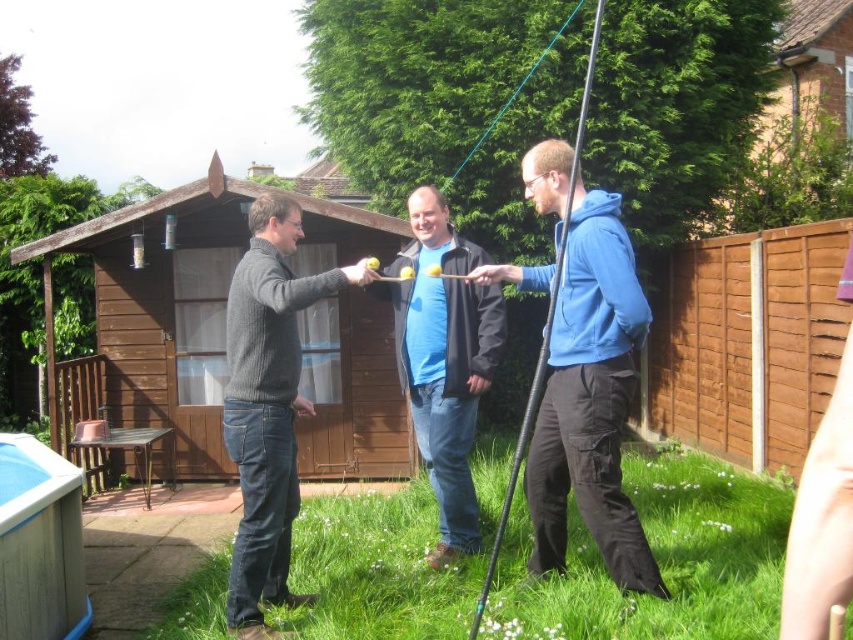
From the picture: You are standing at the point with coordinates (x=163, y=308) in the image. What object are you directly facing?

The point at coordinates (x=163, y=308) is directly facing the brown wooden hut at center.

What are the coordinates of the brown wooden hut at center?

The coordinates of the brown wooden hut at center are at point [163,308].